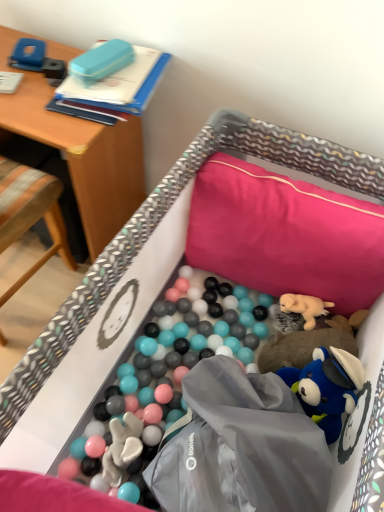
Question: Is the position of pink fabric pillow at upper right less distant than that of wooden chair at left?

Choices:
 (A) no
 (B) yes

Answer: (A)

Question: Is pink fabric pillow at upper right behind wooden chair at left?

Choices:
 (A) yes
 (B) no

Answer: (A)

Question: Could you tell me if pink fabric pillow at upper right is facing wooden chair at left?

Choices:
 (A) yes
 (B) no

Answer: (B)

Question: From the image's perspective, would you say pink fabric pillow at upper right is positioned over wooden chair at left?

Choices:
 (A) yes
 (B) no

Answer: (B)

Question: Can you confirm if pink fabric pillow at upper right is smaller than wooden chair at left?

Choices:
 (A) no
 (B) yes

Answer: (B)

Question: Would you say soft plush dog at center-right is to the left or to the right of wooden chair at left in the picture?

Choices:
 (A) right
 (B) left

Answer: (A)

Question: From their relative heights in the image, would you say soft plush dog at center-right is taller or shorter than wooden chair at left?

Choices:
 (A) tall
 (B) short

Answer: (B)

Question: Does point (306, 308) appear closer or farther from the camera than point (29, 219)?

Choices:
 (A) closer
 (B) farther

Answer: (A)

Question: From a real-world perspective, relative to wooden chair at left, is soft plush dog at center-right vertically above or below?

Choices:
 (A) below
 (B) above

Answer: (A)

Question: From a real-world perspective, is wooden chair at left above or below wooden desk at upper left?

Choices:
 (A) above
 (B) below

Answer: (A)

Question: Relative to wooden desk at upper left, is wooden chair at left in front or behind?

Choices:
 (A) behind
 (B) front

Answer: (B)

Question: Choose the correct answer: Is wooden chair at left inside wooden desk at upper left or outside it?

Choices:
 (A) inside
 (B) outside

Answer: (B)

Question: Is wooden chair at left bigger or smaller than wooden desk at upper left?

Choices:
 (A) big
 (B) small

Answer: (B)

Question: Is wooden desk at upper left taller or shorter than soft plush dog at center-right?

Choices:
 (A) tall
 (B) short

Answer: (A)

Question: Is wooden desk at upper left bigger or smaller than soft plush dog at center-right?

Choices:
 (A) small
 (B) big

Answer: (B)